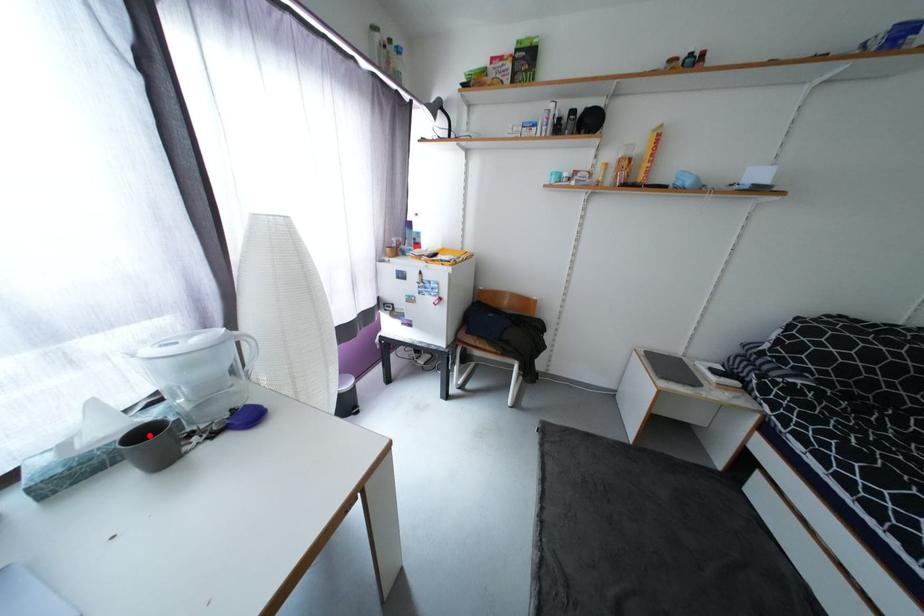
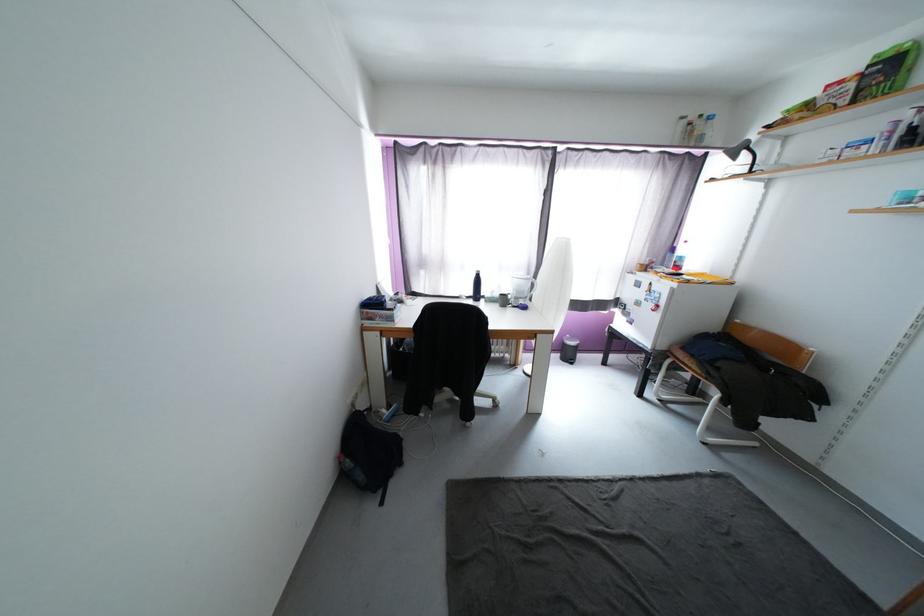
Where in the second image is the point corresponding to the highlighted location from the first image?

(508, 296)